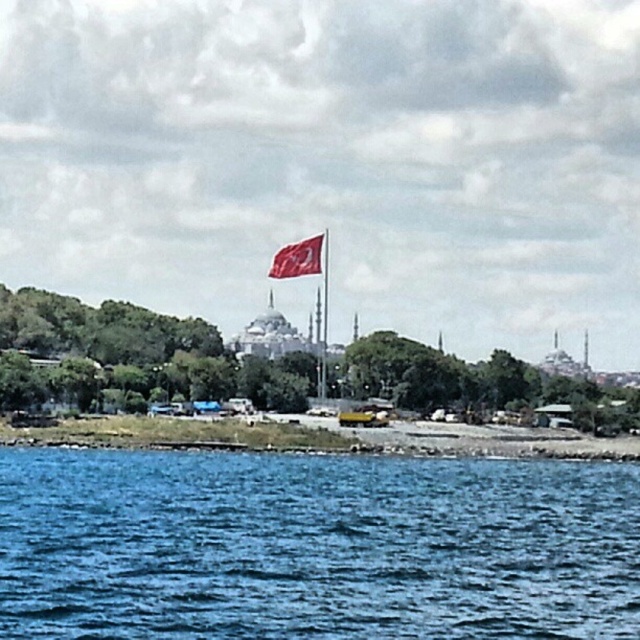
Can you confirm if blue liquid water at lower center is taller than red fabric flag at center?

No.

Does blue liquid water at lower center have a lesser width compared to red fabric flag at center?

No.

What do you see at coordinates (314, 545) in the screenshot?
I see `blue liquid water at lower center` at bounding box center [314, 545].

Identify the location of blue liquid water at lower center. Image resolution: width=640 pixels, height=640 pixels. (314, 545).